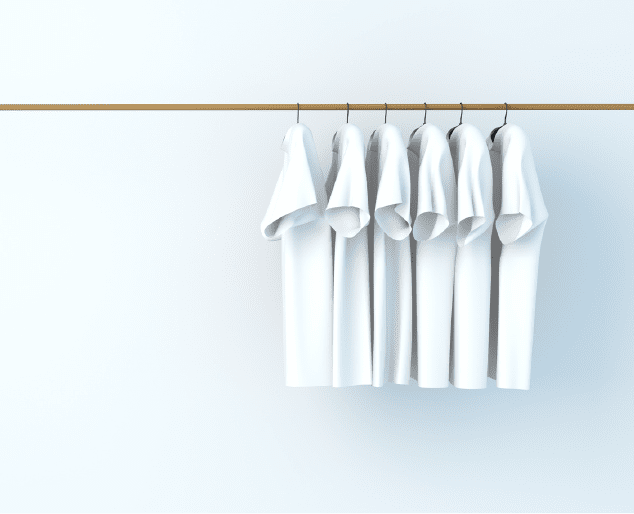
What are the coordinates of `hangers` in the screenshot? It's located at (299, 109), (347, 116), (389, 114), (422, 116), (460, 116), (503, 117).